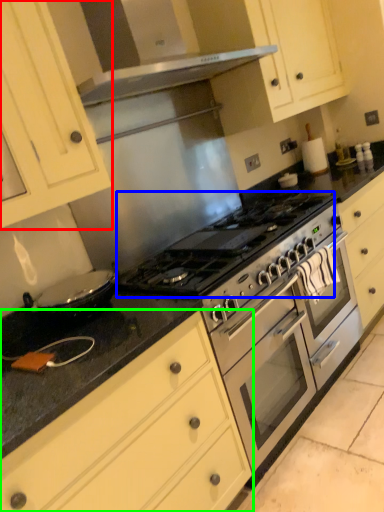
Question: Considering the real-world distances, which object is farthest from cabinetry (highlighted by a red box)? gas stove (highlighted by a blue box) or cabinetry (highlighted by a green box)?

Choices:
 (A) gas stove
 (B) cabinetry

Answer: (B)